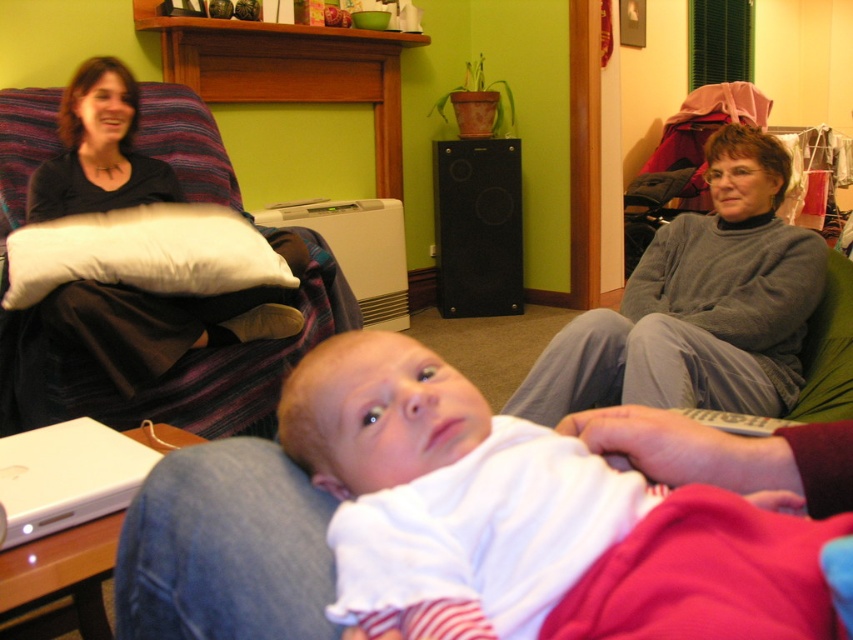
You are a delivery person who needs to place a package between the white soft fabric baby at center and the white matte laptop at lower left. The package is 20 inches long. Can you fit it in the space between them?

The distance between the white soft fabric baby at center and the white matte laptop at lower left is 25.80 inches. Since the package is 20 inches long, it can fit in the space between them as there is enough room.

You are a photographer setting up a shoot in this living room. You need to place a small lamp next to the white soft fabric baby at center so that it doesn not block the view of the vibrant green walls. Where should you position the lamp relative to the baby?

The lamp should be placed to the side of the white soft fabric baby at center, ensuring it doesn not obstruct the view of the vibrant green walls. Since the baby is at point (527,518), positioning the lamp either to the left or right along the same horizontal plane would keep the walls visible.

You are a photographer setting up a shoot in the living room. You need to place a white soft fabric baby at center and a white matte laptop at lower left. According to the scene description, where should you position the white soft fabric baby relative to the white matte laptop?

The white soft fabric baby at center should be placed over the white matte laptop at lower left.